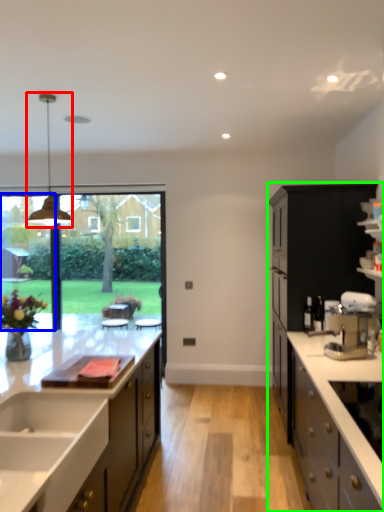
Question: Which object is positioned farthest from light fixture (highlighted by a red box)? Select from window screen (highlighted by a blue box) and cabinetry (highlighted by a green box).

Choices:
 (A) window screen
 (B) cabinetry

Answer: (B)